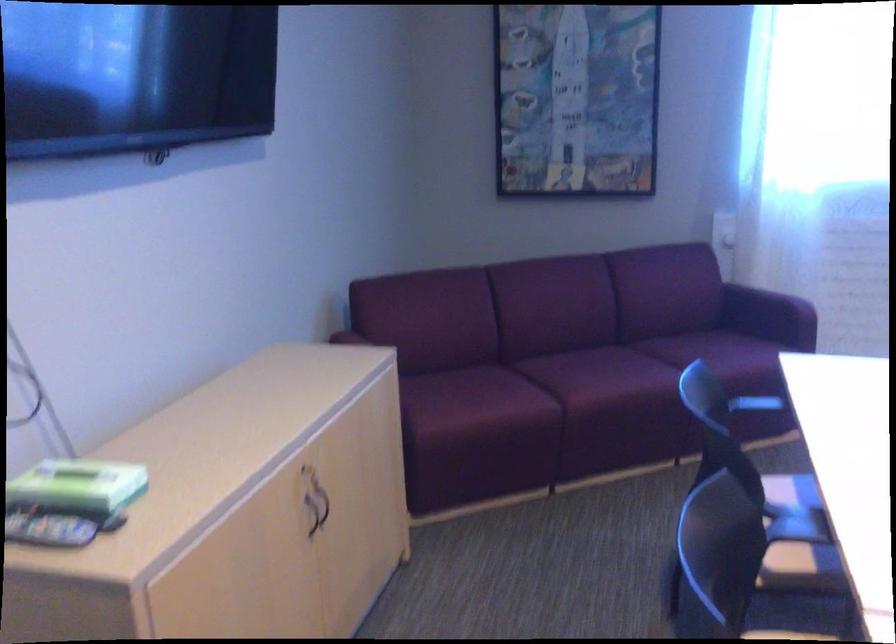
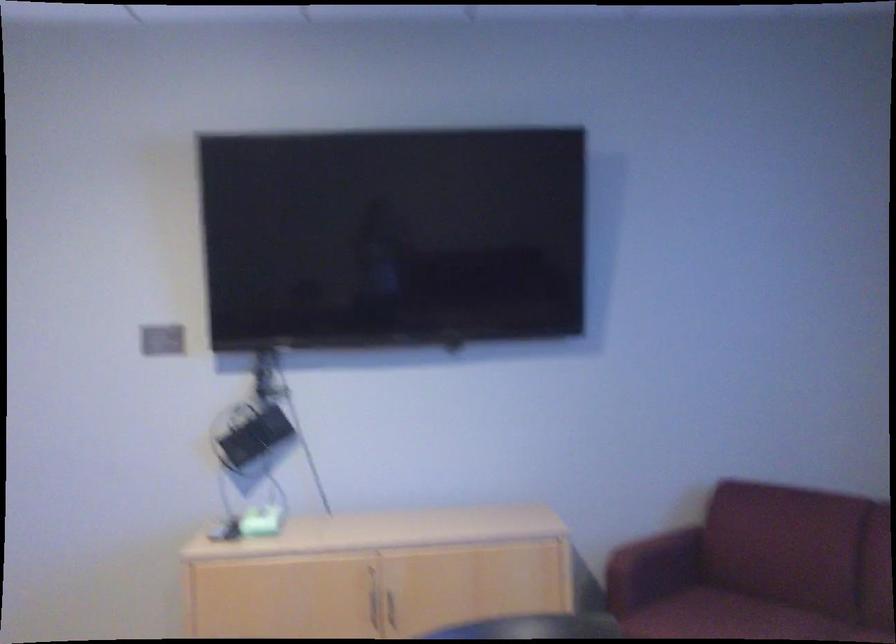
Locate, in the second image, the point that corresponds to [314,511] in the first image.

(374, 607)